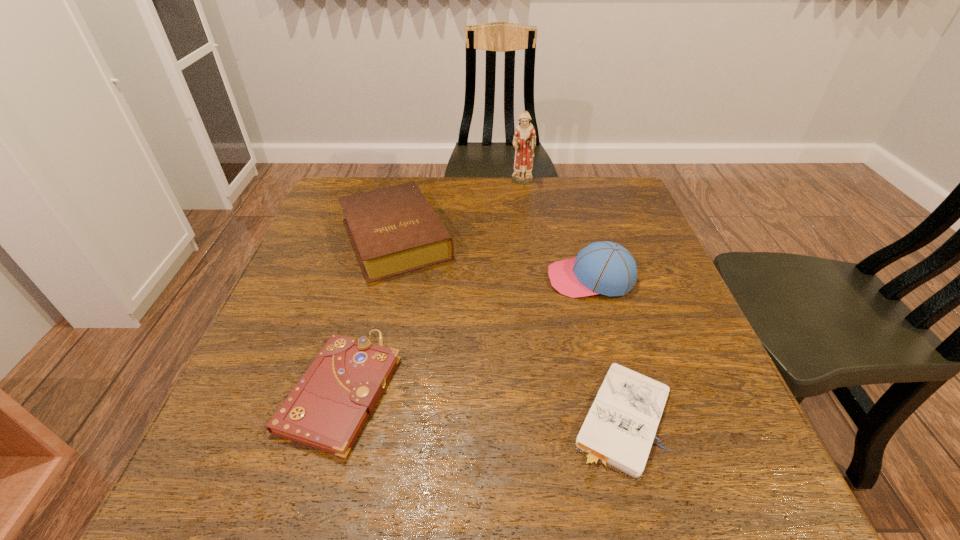
In order to click on notebook that is positioned at the right edge in this screenshot , I will do `click(619, 430)`.

I want to click on object present at the far left corner, so click(394, 230).

Find the location of a particular element. object that is at the near left corner is located at coordinates (326, 410).

The width and height of the screenshot is (960, 540). Identify the location of object that is at the near right corner. (619, 430).

Find the location of a particular element. Image resolution: width=960 pixels, height=540 pixels. vacant space at the far edge of the desktop is located at coordinates (399, 179).

This screenshot has width=960, height=540. In the image, there is a desktop. Find the location of `vacant space at the near edge`. vacant space at the near edge is located at coordinates (359, 502).

I want to click on free space at the left edge, so click(x=281, y=306).

At what (x,y) coordinates should I click in order to perform the action: click on blank space at the right edge. Please return your answer as a coordinate pair (x, y). Looking at the image, I should click on (750, 435).

In order to click on free space at the near left corner in this screenshot , I will do (x=265, y=496).

The height and width of the screenshot is (540, 960). In order to click on free region at the far right corner of the desktop in this screenshot , I will do `click(605, 181)`.